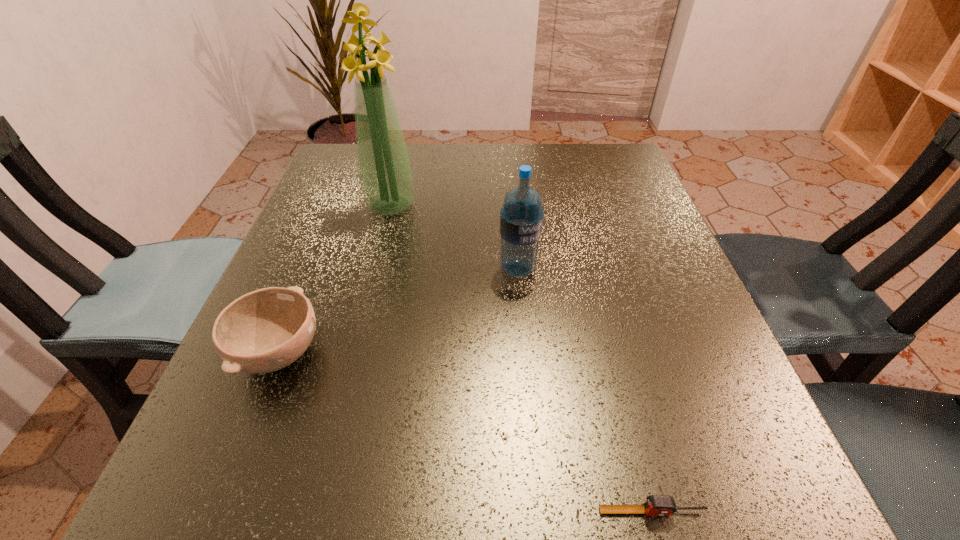
In order to click on vacant space located 0.130m on the right of the bowl in this screenshot , I will do `click(409, 353)`.

Where is `vacant space located 0.290m on the left of the shortest object`? The height and width of the screenshot is (540, 960). vacant space located 0.290m on the left of the shortest object is located at coordinates (351, 511).

Identify the location of object present at the far edge. The width and height of the screenshot is (960, 540). (385, 172).

This screenshot has width=960, height=540. Find the location of `object positioned at the near edge`. object positioned at the near edge is located at coordinates (656, 505).

Locate an element on the screen. This screenshot has height=540, width=960. bouquet that is at the left edge is located at coordinates (385, 172).

You are a GUI agent. You are given a task and a screenshot of the screen. Output one action in this format:
    pyautogui.click(x=<x>, y=<y>)
    Task: Click on the bowl present at the left edge
    
    Given the screenshot: What is the action you would take?
    pyautogui.click(x=263, y=331)

Locate an element on the screen. object that is at the right edge is located at coordinates (656, 505).

I want to click on object that is at the far left corner, so click(385, 172).

Find the location of a particular element. object at the near right corner is located at coordinates (656, 505).

This screenshot has width=960, height=540. Find the location of `vacant region at the far edge of the desktop`. vacant region at the far edge of the desktop is located at coordinates (508, 170).